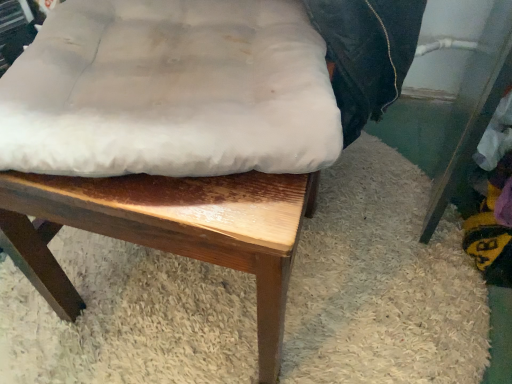
Question: Considering the relative sizes of white fabric cushion at center and white fabric cushion at center in the image provided, is white fabric cushion at center smaller than white fabric cushion at center?

Choices:
 (A) no
 (B) yes

Answer: (A)

Question: Does white fabric cushion at center have a lesser width compared to white fabric cushion at center?

Choices:
 (A) yes
 (B) no

Answer: (B)

Question: Considering the relative sizes of white fabric cushion at center and white fabric cushion at center in the image provided, is white fabric cushion at center taller than white fabric cushion at center?

Choices:
 (A) yes
 (B) no

Answer: (A)

Question: Is white fabric cushion at center positioned in front of white fabric cushion at center?

Choices:
 (A) no
 (B) yes

Answer: (B)

Question: Is there a large distance between white fabric cushion at center and white fabric cushion at center?

Choices:
 (A) no
 (B) yes

Answer: (A)

Question: Is white fabric cushion at center completely or partially outside of white fabric cushion at center?

Choices:
 (A) yes
 (B) no

Answer: (A)

Question: Is white fabric cushion at center placed right next to white fabric cushion at center?

Choices:
 (A) no
 (B) yes

Answer: (B)

Question: Is white fabric cushion at center not close to white fabric cushion at center?

Choices:
 (A) yes
 (B) no

Answer: (B)

Question: Is white fabric cushion at center wider than white fabric cushion at center?

Choices:
 (A) no
 (B) yes

Answer: (A)

Question: From a real-world perspective, is white fabric cushion at center on top of white fabric cushion at center?

Choices:
 (A) yes
 (B) no

Answer: (A)

Question: Can you confirm if white fabric cushion at center is bigger than white fabric cushion at center?

Choices:
 (A) yes
 (B) no

Answer: (B)

Question: Considering the relative positions of white fabric cushion at center and white fabric cushion at center in the image provided, is white fabric cushion at center to the right of white fabric cushion at center from the viewer's perspective?

Choices:
 (A) no
 (B) yes

Answer: (A)

Question: From their relative heights in the image, would you say white fabric cushion at center is taller or shorter than white fabric cushion at center?

Choices:
 (A) short
 (B) tall

Answer: (B)